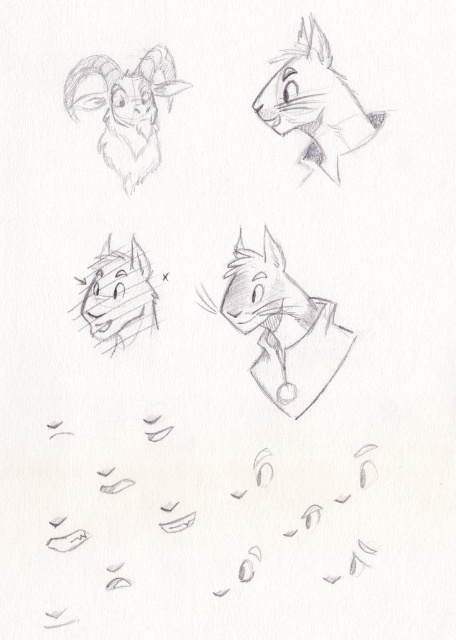
Question: Based on their relative distances, which object is farther from the smooth gray wolf at center?

Choices:
 (A) smooth gray cat at center
 (B) gray pencil sketch of goat at upper left
 (C) smooth gray cat at upper right

Answer: (C)

Question: Can you confirm if smooth gray cat at center is positioned below gray pencil sketch of goat at upper left?

Choices:
 (A) no
 (B) yes

Answer: (B)

Question: Which point is farther from the camera taking this photo?

Choices:
 (A) (77, 305)
 (B) (299, 300)

Answer: (B)

Question: From the image, what is the correct spatial relationship of gray pencil sketch of goat at upper left in relation to smooth gray wolf at center?

Choices:
 (A) below
 (B) above

Answer: (B)

Question: Is smooth gray cat at center bigger than smooth gray wolf at center?

Choices:
 (A) no
 (B) yes

Answer: (B)

Question: Considering the real-world distances, which object is farthest from the gray pencil sketch of goat at upper left?

Choices:
 (A) smooth gray cat at center
 (B) smooth gray wolf at center
 (C) smooth gray cat at upper right

Answer: (A)